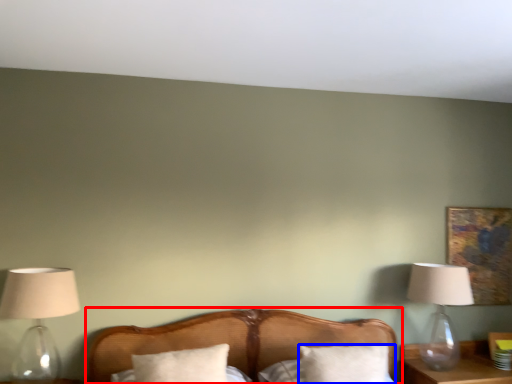
Question: Which of the following is the farthest to the observer, bed (highlighted by a red box) or pillow (highlighted by a blue box)?

Choices:
 (A) bed
 (B) pillow

Answer: (B)